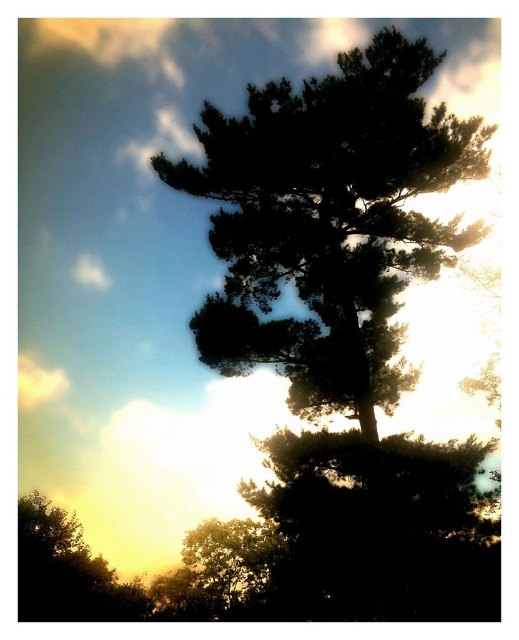
You are an artist trying to paint the scene. You want to ensure the silhouette pine at center and the green leafy tree at lower left are proportionally accurate. Which tree should you paint larger?

The silhouette pine at center should be painted larger than the green leafy tree at lower left because the silhouette pine at center is bigger than green leafy tree at lower left.

You are standing in a field and see the silhouette pine at center and the green leafy tree at lower left. Which tree is positioned more to the east if the sun is setting in the west?

The silhouette pine at center is positioned to the right of the green leafy tree at lower left. Since the sun is setting in the west, the eastern side would be to the left. Therefore, the green leafy tree at lower left is more to the east compared to the silhouette pine at center.